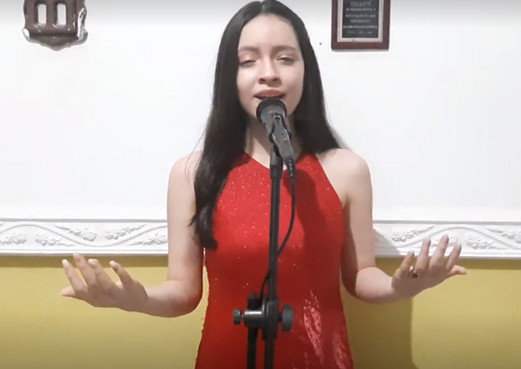
Image resolution: width=521 pixels, height=369 pixels. I want to click on upper part of wall, so click(x=131, y=92).